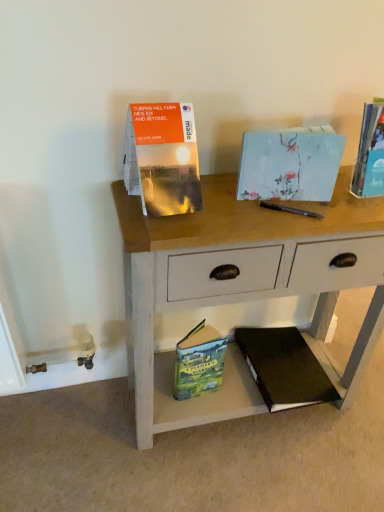
This screenshot has height=512, width=384. I want to click on free space in front of wooden desk at center, so click(239, 471).